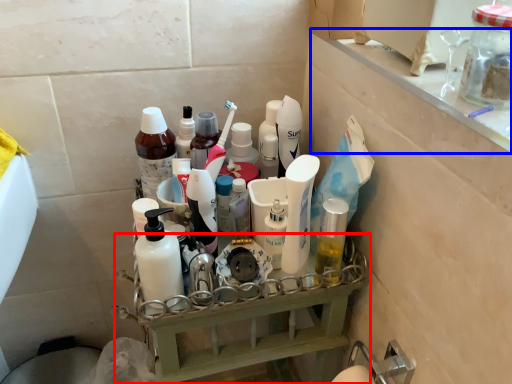
Question: Which object appears farthest to the camera in this image, shelf (highlighted by a red box) or ledge (highlighted by a blue box)?

Choices:
 (A) shelf
 (B) ledge

Answer: (A)